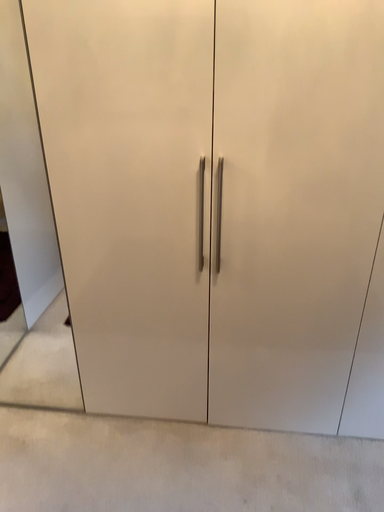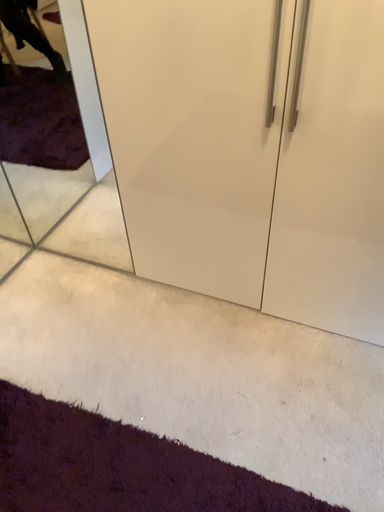
Question: Which way did the camera rotate in the video?

Choices:
 (A) rotated right
 (B) rotated left

Answer: (B)